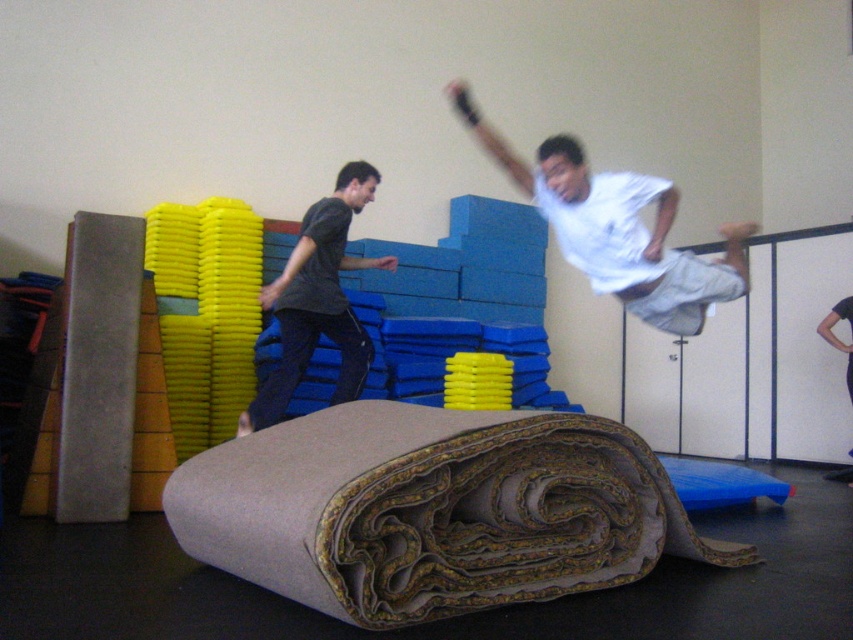
Is textured beige carpet at lower center to the left of black fabric pants at lower right from the viewer's perspective?

Correct, you'll find textured beige carpet at lower center to the left of black fabric pants at lower right.

Between textured beige carpet at lower center and black fabric pants at lower right, which one appears on the left side from the viewer's perspective?

Positioned to the left is textured beige carpet at lower center.

Is point (360, 529) closer to camera compared to point (850, 481)?

Yes, point (360, 529) is in front of point (850, 481).

Where is `textured beige carpet at lower center`? Image resolution: width=853 pixels, height=640 pixels. textured beige carpet at lower center is located at coordinates (432, 509).

Is dark gray t-shirt at left closer to the viewer compared to black fabric pants at lower right?

Yes, dark gray t-shirt at left is closer to the viewer.

Measure the distance from dark gray t-shirt at left to black fabric pants at lower right.

They are 3.20 meters apart.

Where is `dark gray t-shirt at left`? The height and width of the screenshot is (640, 853). dark gray t-shirt at left is located at coordinates (317, 300).

Based on the photo, which of these two, white matte shirt at upper center or dark gray t-shirt at left, stands taller?

Standing taller between the two is dark gray t-shirt at left.

Locate an element on the screen. The image size is (853, 640). white matte shirt at upper center is located at coordinates (618, 228).

Is point (573, 195) closer to viewer compared to point (310, 346)?

Yes, it is.

Where is `white matte shirt at upper center`? This screenshot has height=640, width=853. white matte shirt at upper center is located at coordinates (618, 228).